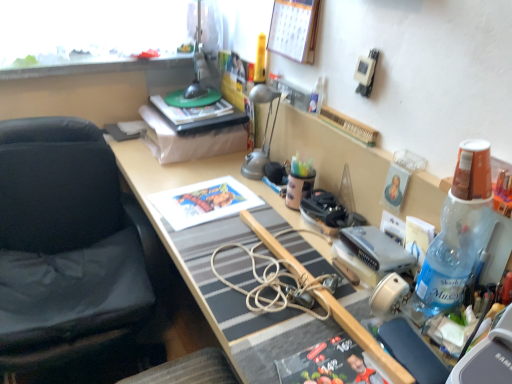
Question: Can we say wooden calendar at upper center lies outside silver metallic game console at center-right?

Choices:
 (A) yes
 (B) no

Answer: (A)

Question: Are wooden calendar at upper center and silver metallic game console at center-right far apart?

Choices:
 (A) no
 (B) yes

Answer: (A)

Question: Considering the relative sizes of wooden calendar at upper center and silver metallic game console at center-right in the image provided, is wooden calendar at upper center taller than silver metallic game console at center-right?

Choices:
 (A) no
 (B) yes

Answer: (B)

Question: Can you confirm if wooden calendar at upper center is wider than silver metallic game console at center-right?

Choices:
 (A) yes
 (B) no

Answer: (B)

Question: Considering the relative positions of wooden calendar at upper center and silver metallic game console at center-right in the image provided, is wooden calendar at upper center behind silver metallic game console at center-right?

Choices:
 (A) yes
 (B) no

Answer: (A)

Question: Can you confirm if wooden calendar at upper center is smaller than silver metallic game console at center-right?

Choices:
 (A) no
 (B) yes

Answer: (A)

Question: Is matte paper print at center bigger than silver metallic game console at center-right?

Choices:
 (A) yes
 (B) no

Answer: (A)

Question: Considering the relative sizes of matte paper print at center and silver metallic game console at center-right in the image provided, is matte paper print at center thinner than silver metallic game console at center-right?

Choices:
 (A) yes
 (B) no

Answer: (B)

Question: From a real-world perspective, is matte paper print at center beneath silver metallic game console at center-right?

Choices:
 (A) no
 (B) yes

Answer: (B)

Question: From a real-world perspective, does matte paper print at center stand above silver metallic game console at center-right?

Choices:
 (A) no
 (B) yes

Answer: (A)

Question: Can you confirm if matte paper print at center is smaller than silver metallic game console at center-right?

Choices:
 (A) no
 (B) yes

Answer: (A)

Question: Considering the relative positions of matte paper print at center and silver metallic game console at center-right in the image provided, is matte paper print at center to the right of silver metallic game console at center-right from the viewer's perspective?

Choices:
 (A) no
 (B) yes

Answer: (A)

Question: Considering the relative sizes of matte paper print at center and hardcover book at center in the image provided, is matte paper print at center bigger than hardcover book at center?

Choices:
 (A) no
 (B) yes

Answer: (A)